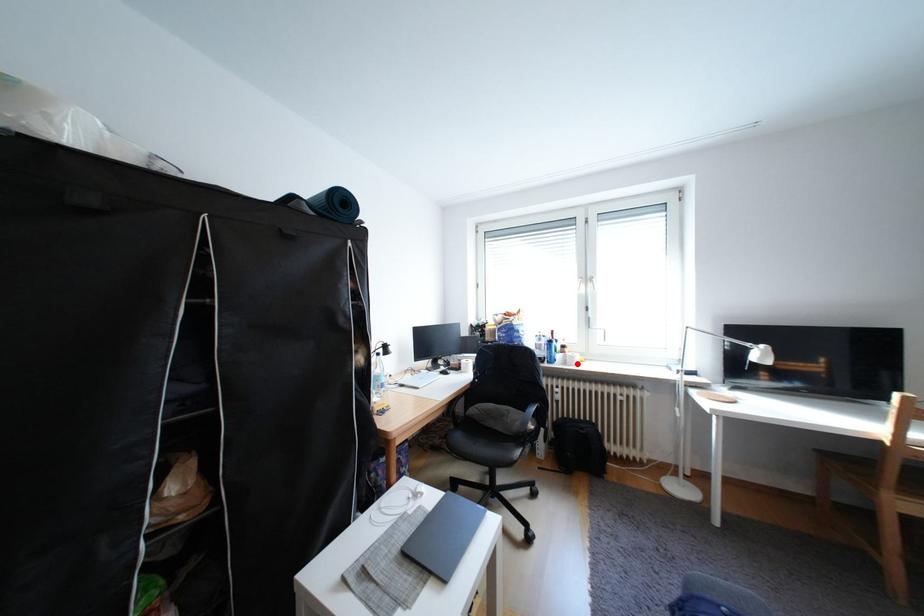
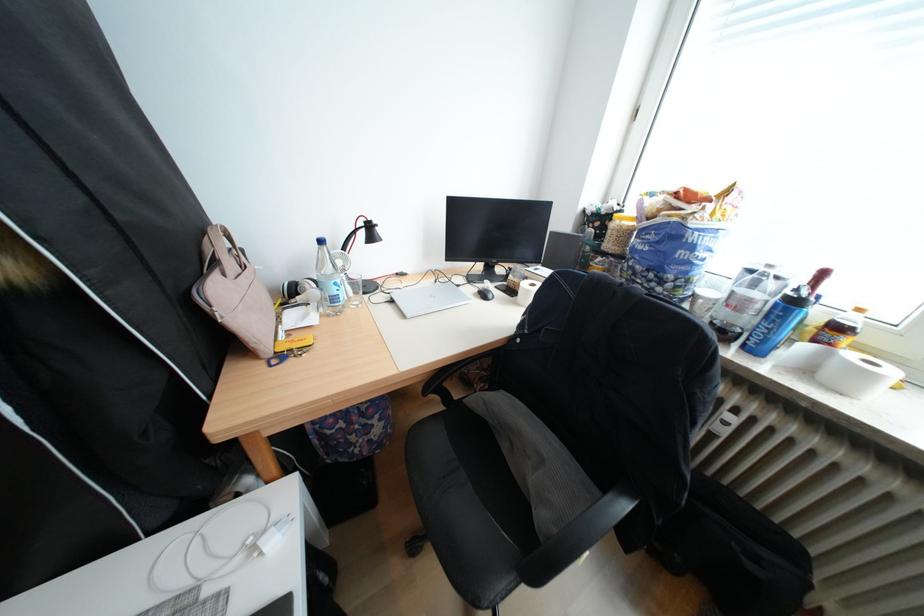
Locate, in the second image, the point that corresponds to the highlighted location in the first image.

(821, 371)